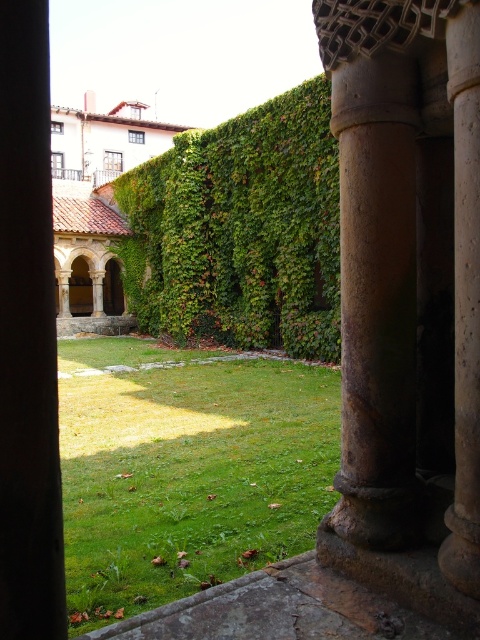
Question: Does green grass at center have a lesser width compared to green leafy hedge at center?

Choices:
 (A) yes
 (B) no

Answer: (A)

Question: Which point appears closest to the camera in this image?

Choices:
 (A) (479, 216)
 (B) (37, 12)
 (C) (243, 394)
 (D) (245, 326)

Answer: (B)

Question: Does green grass at center appear under green leafy hedge at center?

Choices:
 (A) yes
 (B) no

Answer: (A)

Question: Which object is positioned closest to the brown stone pillar at left?

Choices:
 (A) brown stone column at right
 (B) green grass at center
 (C) green leafy hedge at center

Answer: (A)

Question: Which object is farther from the camera taking this photo?

Choices:
 (A) green leafy hedge at center
 (B) green grass at center

Answer: (A)

Question: Does brown stone pillar at left appear on the right side of brown stone column at right?

Choices:
 (A) yes
 (B) no

Answer: (B)